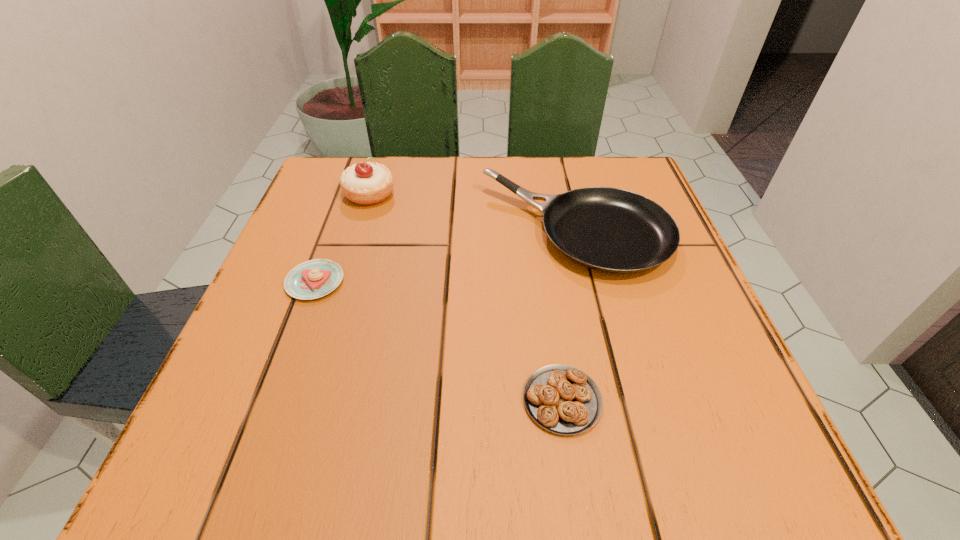
At what (x,y) coordinates should I click in order to perform the action: click on vacant position at the far right corner of the desktop. Please return your answer as a coordinate pair (x, y). This screenshot has width=960, height=540. Looking at the image, I should click on (603, 159).

This screenshot has width=960, height=540. Find the location of `free point between the second farthest pastry and the nearest pastry`. free point between the second farthest pastry and the nearest pastry is located at coordinates click(x=439, y=341).

Where is `unoccupied area between the second nearest pastry and the farthest pastry`? unoccupied area between the second nearest pastry and the farthest pastry is located at coordinates (343, 238).

Locate an element on the screen. This screenshot has height=540, width=960. free area in between the nearest pastry and the second tallest object is located at coordinates (569, 316).

Where is `vacant area that lies between the nearest object and the farthest pastry`? vacant area that lies between the nearest object and the farthest pastry is located at coordinates (466, 297).

Where is `free space between the rightmost pastry and the pan`? The image size is (960, 540). free space between the rightmost pastry and the pan is located at coordinates (569, 316).

This screenshot has height=540, width=960. In order to click on unoccupied area between the rightmost pastry and the second farthest pastry in this screenshot , I will do `click(439, 341)`.

The image size is (960, 540). Identify the location of empty space between the tallest object and the nearest object. (466, 297).

Locate an element on the screen. The height and width of the screenshot is (540, 960). vacant space that's between the nearest pastry and the tallest object is located at coordinates (466, 297).

Locate an element on the screen. Image resolution: width=960 pixels, height=540 pixels. free space that is in between the second tallest object and the second farthest pastry is located at coordinates (445, 256).